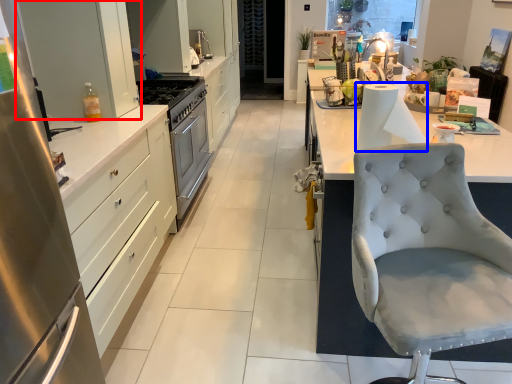
Question: Which of the following is the closest to the observer, cabinetry (highlighted by a red box) or paper towel (highlighted by a blue box)?

Choices:
 (A) cabinetry
 (B) paper towel

Answer: (B)